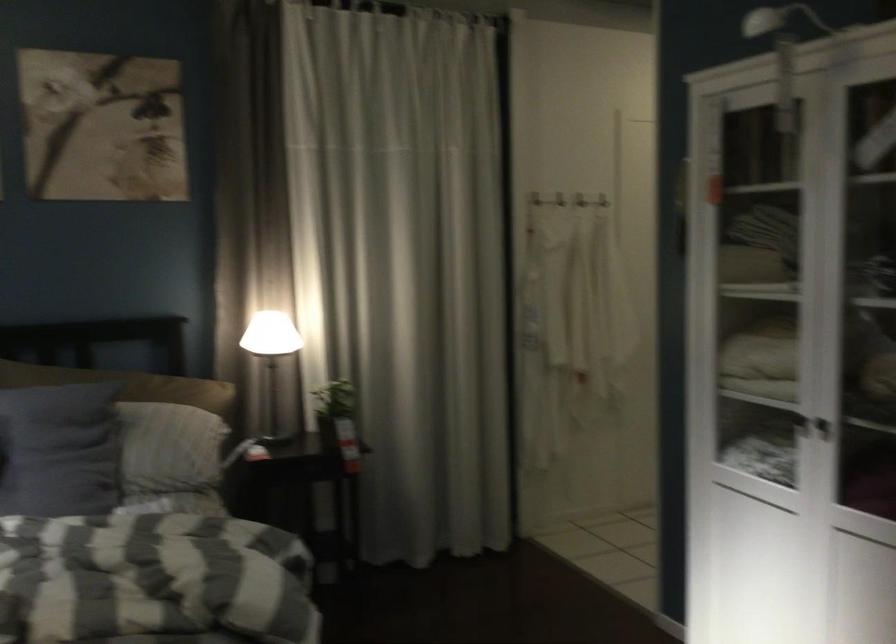
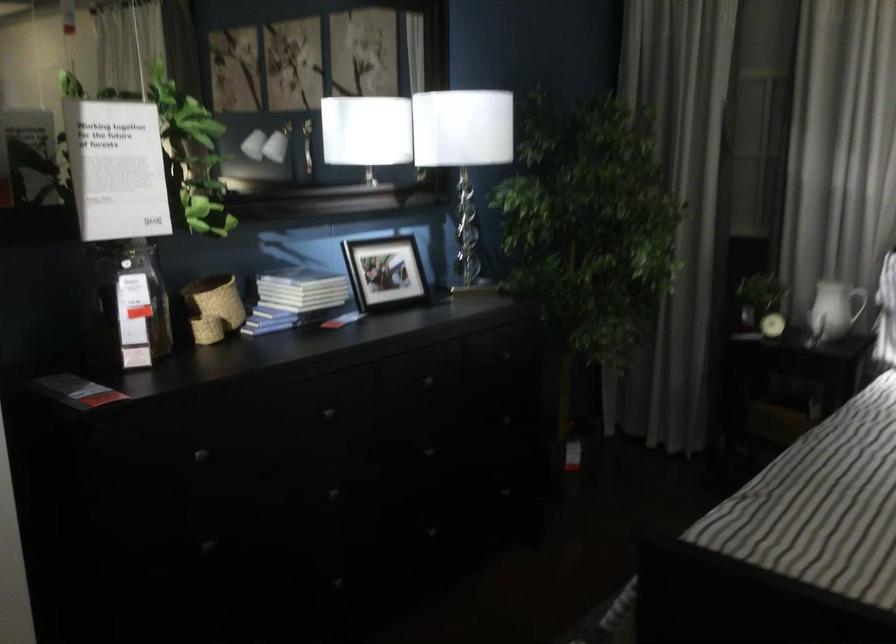
Question: Based on the continuous images, in which direction is the camera rotating? Reply with the corresponding letter.

Choices:
 (A) Left
 (B) Right
 (C) Up
 (D) Down

Answer: (A)